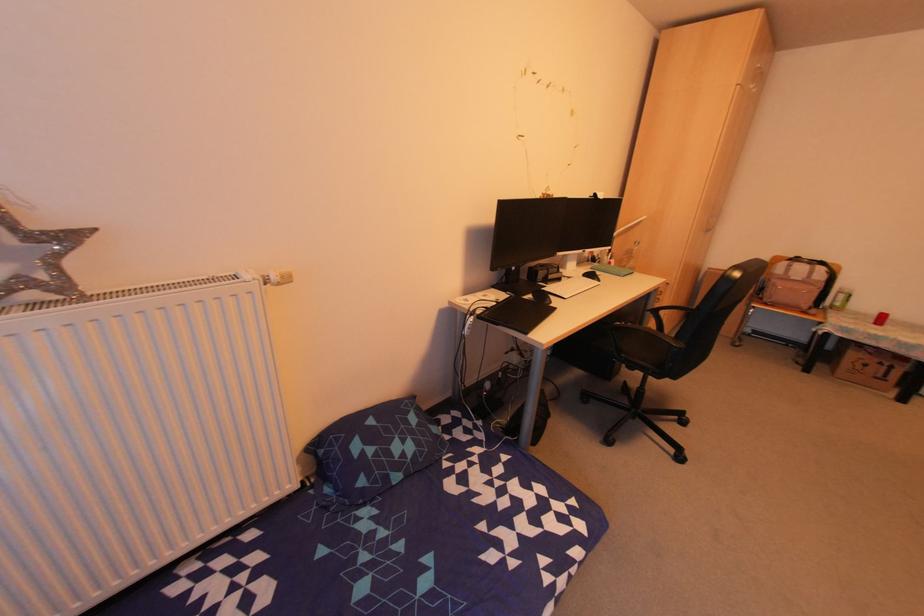
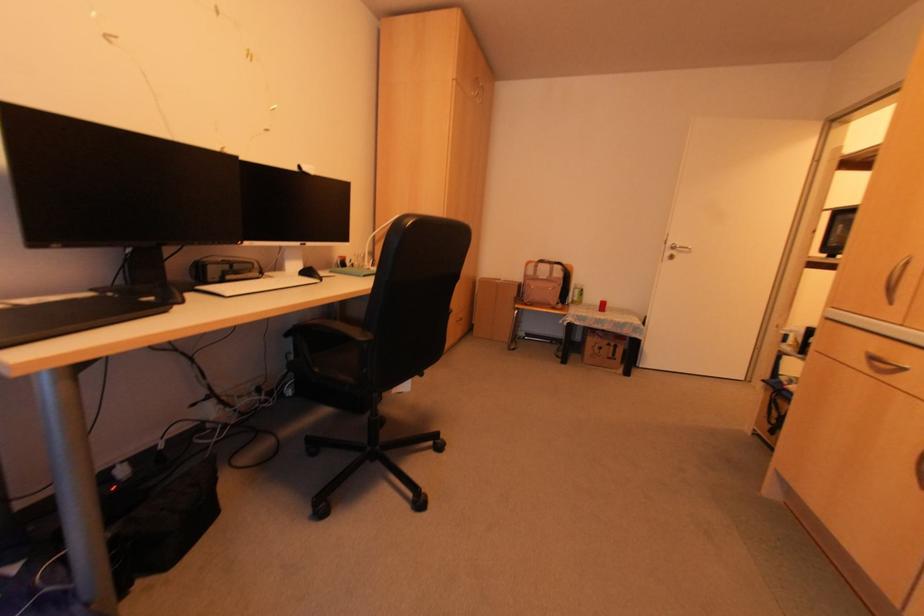
Question: The camera is either moving clockwise (left) or counter-clockwise (right) around the object. The first image is from the beginning of the video and the second image is from the end. Is the camera moving left or right when shooting the video?

Choices:
 (A) Left
 (B) Right

Answer: (A)